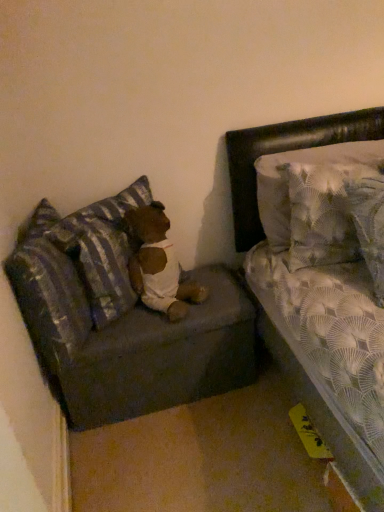
Question: Relative to patterned fabric pillow at upper right, which is counted as the first pillow, starting from the right, is dark gray fabric couch at lower left in front or behind?

Choices:
 (A) behind
 (B) front

Answer: (A)

Question: Is point (97, 215) positioned closer to the camera than point (317, 147)?

Choices:
 (A) closer
 (B) farther

Answer: (A)

Question: Which is nearer to the patterned fabric pillow at upper right, which is counted as the third pillow, starting from the left?

Choices:
 (A) brown plush teddy bear at center
 (B) striped fabric pillow at left, which appears as the second pillow when viewed from the right
 (C) dark gray fabric couch at lower left
 (D) striped fabric pillow at left, positioned as the first pillow in left-to-right order

Answer: (A)

Question: Considering the real-world distances, which object is closest to the striped fabric pillow at left, which appears as the second pillow when viewed from the right?

Choices:
 (A) patterned fabric pillow at upper right, which is counted as the first pillow, starting from the right
 (B) dark gray fabric couch at lower left
 (C) brown plush teddy bear at center
 (D) striped fabric pillow at left, which appears as the 3th pillow when viewed from the right

Answer: (C)